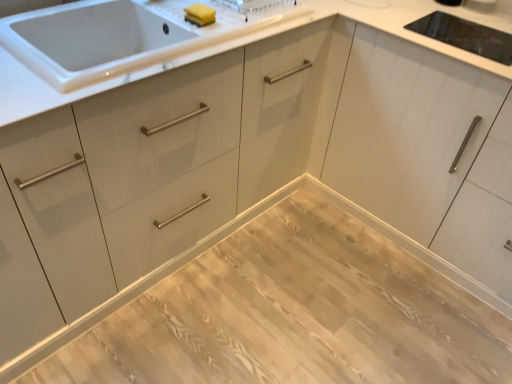
I want to click on yellow sponge at upper center, so click(200, 14).

This screenshot has width=512, height=384. Describe the element at coordinates (200, 14) in the screenshot. I see `yellow sponge at upper center` at that location.

Locate an element on the screen. This screenshot has width=512, height=384. yellow sponge at upper center is located at coordinates (200, 14).